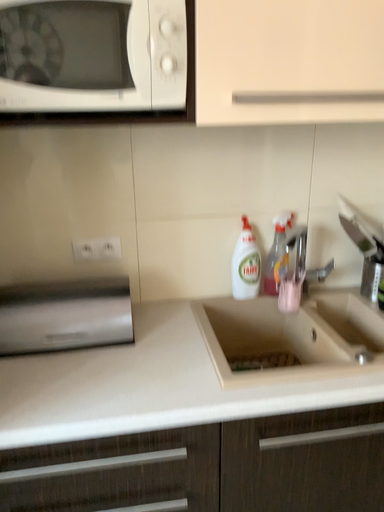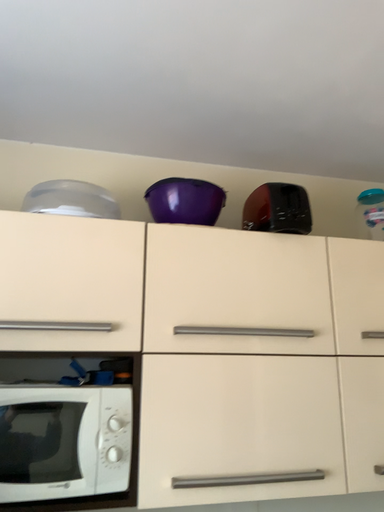
Question: Which way did the camera rotate in the video?

Choices:
 (A) rotated downward
 (B) rotated upward

Answer: (B)